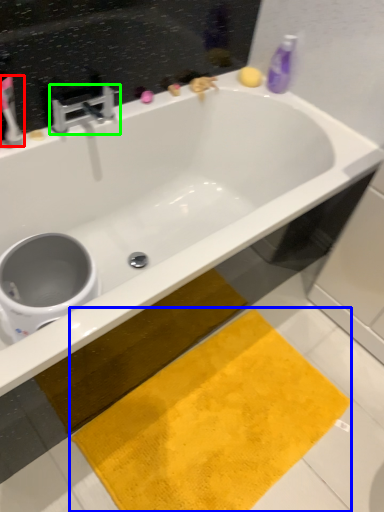
Question: Estimate the real-world distances between objects in this image. Which object is closer to toothbrush (highlighted by a red box), beach towel (highlighted by a blue box) or tap (highlighted by a green box)?

Choices:
 (A) beach towel
 (B) tap

Answer: (B)